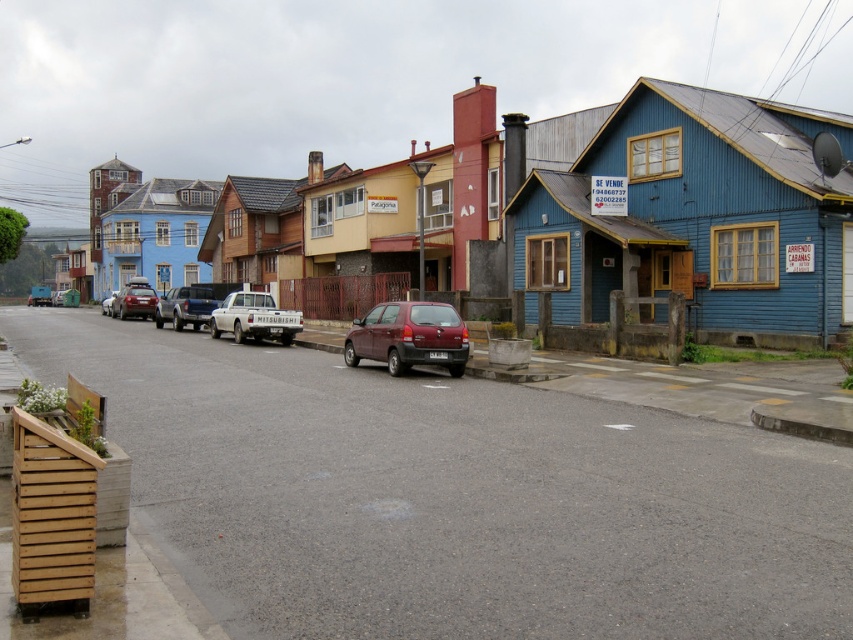
You are a delivery driver approaching the street and need to park your vehicle. You have a choice between parking in a compact parking spot or a standard parking spot. The compact spot requires a vehicle shorter than 14 feet. The standard spot is for vehicles up to 16 feet. Which parking spot should you choose for the maroon matte hatchback at center and the metallic silver sedan at center?

The maroon matte hatchback at center is shorter than the metallic silver sedan at center. Since the compact spot requires a vehicle shorter than 14 feet, the maroon matte hatchback at center can fit there. The metallic silver sedan at center is taller, so it should use the standard parking spot for vehicles up to 16 feet.

You are a delivery driver who needs to park your vehicle in this street scene. You have a white matte pickup truck at center and a matte red car at center. Which vehicle would require a wider parking space?

The white matte pickup truck at center requires a wider parking space because its width surpasses that of the matte red car at center.